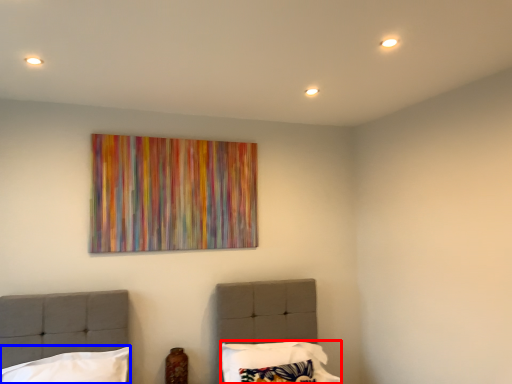
Question: Which object appears farthest to the camera in this image, pillow (highlighted by a red box) or pillow (highlighted by a blue box)?

Choices:
 (A) pillow
 (B) pillow

Answer: (A)